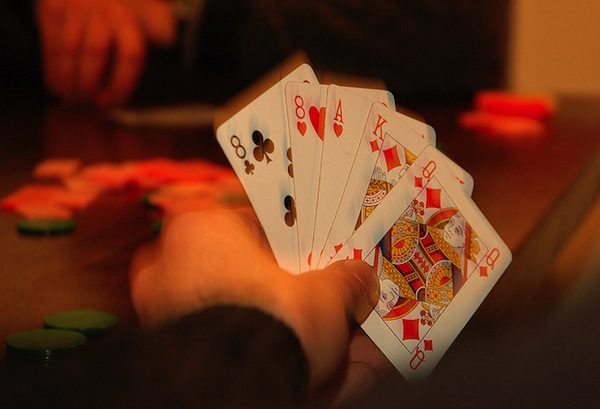
At what (x,y) coordinates should I click in order to perform the action: click on playing cards. Please return your answer as a coordinate pair (x, y). This screenshot has height=409, width=600. Looking at the image, I should click on pos(409,244), pos(367,171), pos(327,168), pos(302,167), pos(270,178).